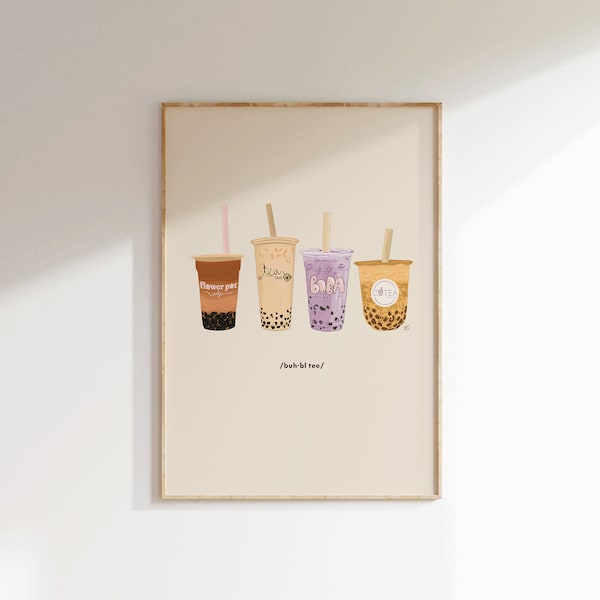
In order to click on wall in this screenshot , I will do `click(96, 328)`.